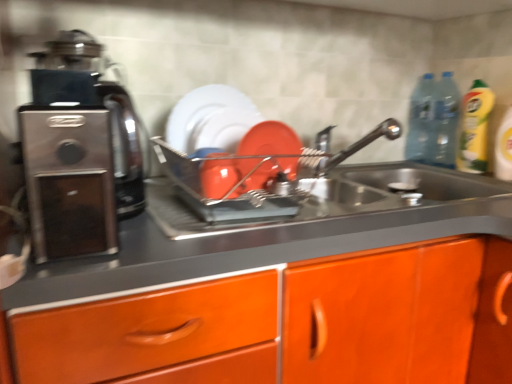
Measure the distance between point (367, 136) and camera.

Point (367, 136) is 1.20 meters from camera.

Describe the element at coordinates (444, 123) in the screenshot. I see `transparent plastic bottle at upper right, which is counted as the second bottle, starting from the left` at that location.

What do you see at coordinates (222, 189) in the screenshot? The height and width of the screenshot is (384, 512). I see `shiny metallic dish rack at center` at bounding box center [222, 189].

Identify the location of transparent plastic bottle at upper right, which is the 2th bottle in right-to-left order. (420, 118).

Measure the distance between satin black coffee machine at left and camera.

satin black coffee machine at left and camera are 21.31 inches apart.

Describe the element at coordinates (79, 152) in the screenshot. I see `satin black coffee machine at left` at that location.

Where is `satin nickel faucet at upper center`? satin nickel faucet at upper center is located at coordinates (360, 145).

How distant is shiny metallic dish rack at center from transparent plastic bottle at upper right, which ranks as the first bottle in left-to-right order?

The distance of shiny metallic dish rack at center from transparent plastic bottle at upper right, which ranks as the first bottle in left-to-right order, is 89.55 centimeters.

Which bottle is the 1st one when counting from the right side of the shiny metallic dish rack at center? Please provide its 2D coordinates.

[(420, 118)]

Is shiny metallic dish rack at center taller than transparent plastic bottle at upper right, which ranks as the first bottle in left-to-right order?

No.

Could you tell me if shiny metallic dish rack at center is turned towards transparent plastic bottle at upper right, which ranks as the first bottle in left-to-right order?

No.

Can you confirm if matte orange plate at center is taller than satin nickel faucet at upper center?

Indeed, matte orange plate at center has a greater height compared to satin nickel faucet at upper center.

Consider the image. Looking at their sizes, would you say matte orange plate at center is wider or thinner than satin nickel faucet at upper center?

In the image, matte orange plate at center appears to be more narrow than satin nickel faucet at upper center.

Can you confirm if matte orange plate at center is bigger than satin nickel faucet at upper center?

Actually, matte orange plate at center might be smaller than satin nickel faucet at upper center.

Considering the sizes of transparent plastic bottle at upper right, which ranks as the first bottle in left-to-right order, and yellow liquid bottle at right in the image, is transparent plastic bottle at upper right, which ranks as the first bottle in left-to-right order, bigger or smaller than yellow liquid bottle at right?

Clearly, transparent plastic bottle at upper right, which ranks as the first bottle in left-to-right order, is larger in size than yellow liquid bottle at right.

Looking at this image, how much distance is there between transparent plastic bottle at upper right, which ranks as the first bottle in left-to-right order, and yellow liquid bottle at right?

The distance of transparent plastic bottle at upper right, which ranks as the first bottle in left-to-right order, from yellow liquid bottle at right is 7.94 inches.

Is transparent plastic bottle at upper right, which is the 2th bottle in right-to-left order, aimed at yellow liquid bottle at right?

No.

Does transparent plastic bottle at upper right, which is the 2th bottle in right-to-left order, come behind yellow liquid bottle at right?

Yes, transparent plastic bottle at upper right, which is the 2th bottle in right-to-left order, is behind yellow liquid bottle at right.

Measure the distance from satin metallic sink at center to matte orange plate at center.

27.27 centimeters.

Does satin metallic sink at center have a greater height compared to matte orange plate at center?

No, satin metallic sink at center is not taller than matte orange plate at center.

Which object is further away from the camera, satin metallic sink at center or matte orange plate at center?

Positioned behind is matte orange plate at center.

Looking at this image, between satin metallic sink at center and matte orange plate at center, which one has larger size?

satin metallic sink at center is bigger.

Which object is thinner, yellow liquid bottle at right or satin black coffee machine at left?

yellow liquid bottle at right is thinner.

From a real-world perspective, is yellow liquid bottle at right physically located above or below satin black coffee machine at left?

yellow liquid bottle at right is below satin black coffee machine at left.

Is yellow liquid bottle at right not within satin black coffee machine at left?

yellow liquid bottle at right lies outside satin black coffee machine at left's area.

Can you tell me how much yellow liquid bottle at right and satin black coffee machine at left differ in facing direction?

They differ by 80.7 degrees in their facing directions.

Between transparent plastic bottle at upper right, which is the first bottle in right-to-left order, and matte orange plate at center, which one has smaller size?

With smaller size is matte orange plate at center.

Which object is wider, transparent plastic bottle at upper right, which is counted as the second bottle, starting from the left, or matte orange plate at center?

With larger width is transparent plastic bottle at upper right, which is counted as the second bottle, starting from the left.

Image resolution: width=512 pixels, height=384 pixels. Find the location of `kitchen appliance lying on the left of transparent plastic bottle at upper right, which is the first bottle in right-to-left order`. kitchen appliance lying on the left of transparent plastic bottle at upper right, which is the first bottle in right-to-left order is located at coordinates (x=268, y=154).

From the picture: Between transparent plastic bottle at upper right, which is counted as the second bottle, starting from the left, and matte orange plate at center, which one has less height?

With less height is matte orange plate at center.

Which is closer, (x=483, y=92) or (x=232, y=183)?

Point (x=483, y=92) is positioned farther from the camera compared to point (x=232, y=183).

Are yellow liquid bottle at right and shiny metallic dish rack at center making contact?

No, yellow liquid bottle at right is not next to shiny metallic dish rack at center.

Considering the relative sizes of yellow liquid bottle at right and shiny metallic dish rack at center in the image provided, is yellow liquid bottle at right smaller than shiny metallic dish rack at center?

Yes, yellow liquid bottle at right is smaller than shiny metallic dish rack at center.

What's the angular difference between yellow liquid bottle at right and shiny metallic dish rack at center's facing directions?

82.5 degrees.

This screenshot has height=384, width=512. I want to click on appliance below the transparent plastic bottle at upper right, which is the 2th bottle in right-to-left order (from a real-world perspective), so click(222, 189).

You are a GUI agent. You are given a task and a screenshot of the screen. Output one action in this format:
    pyautogui.click(x=<x>, y=<y>)
    Task: Click on the tap lying above the matte orange plate at center (from the image's perspective)
    
    Given the screenshot: What is the action you would take?
    pyautogui.click(x=360, y=145)

When comparing their distances from shiny metallic dish rack at center, does transparent plastic bottle at upper right, which ranks as the first bottle in left-to-right order, or yellow liquid bottle at right seem closer?

Based on the image, yellow liquid bottle at right appears to be nearer to shiny metallic dish rack at center.

Considering their positions, is transparent plastic bottle at upper right, which is the first bottle in right-to-left order, positioned closer to transparent plastic bottle at upper right, which is the 2th bottle in right-to-left order, than satin metallic sink at center?

The object closer to transparent plastic bottle at upper right, which is the 2th bottle in right-to-left order, is transparent plastic bottle at upper right, which is the first bottle in right-to-left order.

When comparing their distances from matte orange plate at center, does shiny metallic dish rack at center or transparent plastic bottle at upper right, which is the first bottle in right-to-left order, seem closer?

shiny metallic dish rack at center lies closer to matte orange plate at center than the other object.

Estimate the real-world distances between objects in this image. Which object is further from satin metallic sink at center, matte orange plate at center or yellow liquid bottle at right?

yellow liquid bottle at right lies further to satin metallic sink at center than the other object.

Considering their positions, is yellow liquid bottle at right positioned closer to transparent plastic bottle at upper right, which is the first bottle in right-to-left order, than satin black coffee machine at left?

The object closer to transparent plastic bottle at upper right, which is the first bottle in right-to-left order, is yellow liquid bottle at right.

Which object lies further to the anchor point shiny metallic dish rack at center, satin nickel faucet at upper center or satin black coffee machine at left?

satin nickel faucet at upper center is further to shiny metallic dish rack at center.

Considering their positions, is shiny metallic dish rack at center positioned closer to yellow liquid bottle at right than satin nickel faucet at upper center?

Based on the image, satin nickel faucet at upper center appears to be nearer to yellow liquid bottle at right.

Which object lies nearer to the anchor point satin black coffee machine at left, shiny metallic dish rack at center or transparent plastic bottle at upper right, which is the 2th bottle in right-to-left order?

shiny metallic dish rack at center lies closer to satin black coffee machine at left than the other object.

Where is `kitchen appliance located between shiny metallic dish rack at center and satin nickel faucet at upper center in the left-right direction`? kitchen appliance located between shiny metallic dish rack at center and satin nickel faucet at upper center in the left-right direction is located at coordinates (268, 154).

Locate an element on the screen. bottle between satin black coffee machine at left and transparent plastic bottle at upper right, which is the first bottle in right-to-left order, in the horizontal direction is located at coordinates (420, 118).

This screenshot has height=384, width=512. I want to click on appliance between satin black coffee machine at left and transparent plastic bottle at upper right, which is counted as the second bottle, starting from the left, so click(222, 189).

Identify the location of tap located between matte orange plate at center and yellow liquid bottle at right in the left-right direction. (360, 145).